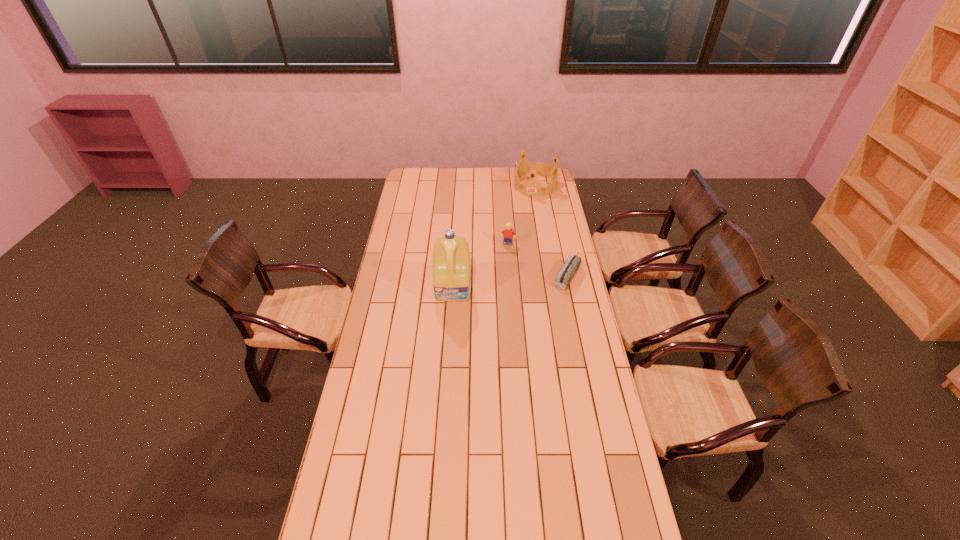
At what (x,y) coordinates should I click in order to perform the action: click on free location located on the front-facing side of the tiara. Please return your answer as a coordinate pair (x, y). Image resolution: width=960 pixels, height=540 pixels. Looking at the image, I should click on (523, 220).

The image size is (960, 540). In order to click on free space located on the front-facing side of the tiara in this screenshot , I will do `click(520, 230)`.

This screenshot has height=540, width=960. What are the coordinates of `vacant space situated 0.130m on the front-facing side of the third nearest object` in the screenshot? It's located at (504, 262).

At what (x,y) coordinates should I click in order to perform the action: click on vacant space located on the front-facing side of the third nearest object. Please return your answer as a coordinate pair (x, y). The image size is (960, 540). Looking at the image, I should click on (502, 270).

Image resolution: width=960 pixels, height=540 pixels. What are the coordinates of `blank area located 0.110m on the front-facing side of the third nearest object` in the screenshot? It's located at (504, 259).

At what (x,y) coordinates should I click in order to perform the action: click on object that is at the far edge. Please return your answer as a coordinate pair (x, y). The height and width of the screenshot is (540, 960). Looking at the image, I should click on (532, 187).

This screenshot has width=960, height=540. I want to click on pencil box situated at the right edge, so 568,270.

At what (x,y) coordinates should I click in order to perform the action: click on tiara at the right edge. Please return your answer as a coordinate pair (x, y). The height and width of the screenshot is (540, 960). Looking at the image, I should click on (532, 187).

The height and width of the screenshot is (540, 960). Identify the location of object positioned at the far right corner. (532, 187).

Locate an element on the screen. free region at the far edge of the desktop is located at coordinates (445, 174).